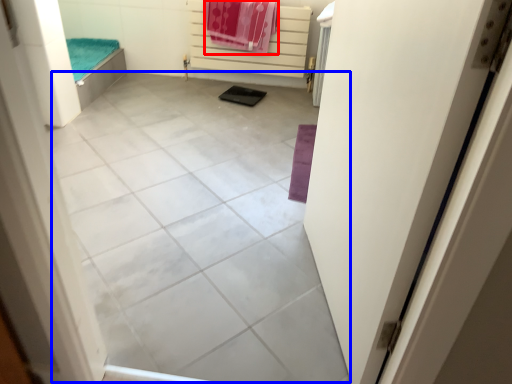
Question: Among these objects, which one is farthest to the camera, beach towel (highlighted by a red box) or tile (highlighted by a blue box)?

Choices:
 (A) beach towel
 (B) tile

Answer: (A)